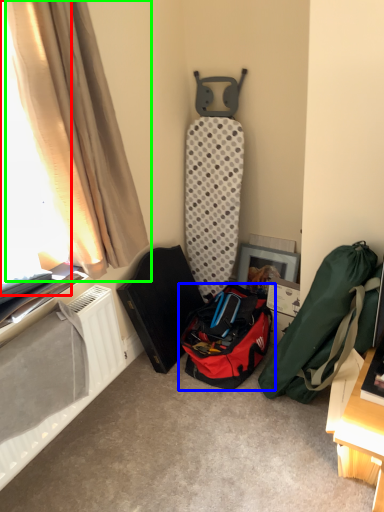
Question: Which object is positioned closest to window screen (highlighted by a red box)? Select from luggage and bags (highlighted by a blue box) and curtain (highlighted by a green box).

Choices:
 (A) luggage and bags
 (B) curtain

Answer: (B)